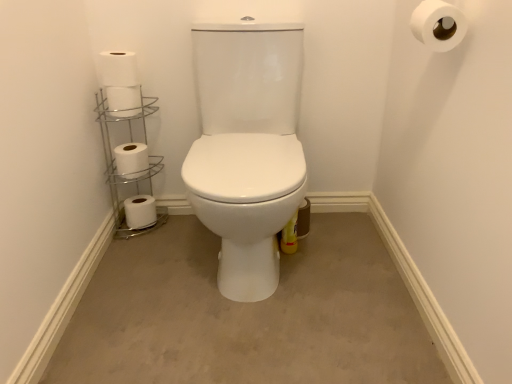
At what (x,y) coordinates should I click in order to perform the action: click on free spot above beige carpet at center (from a real-world perspective). Please return your answer as a coordinate pair (x, y). This screenshot has width=512, height=384. Looking at the image, I should click on (255, 297).